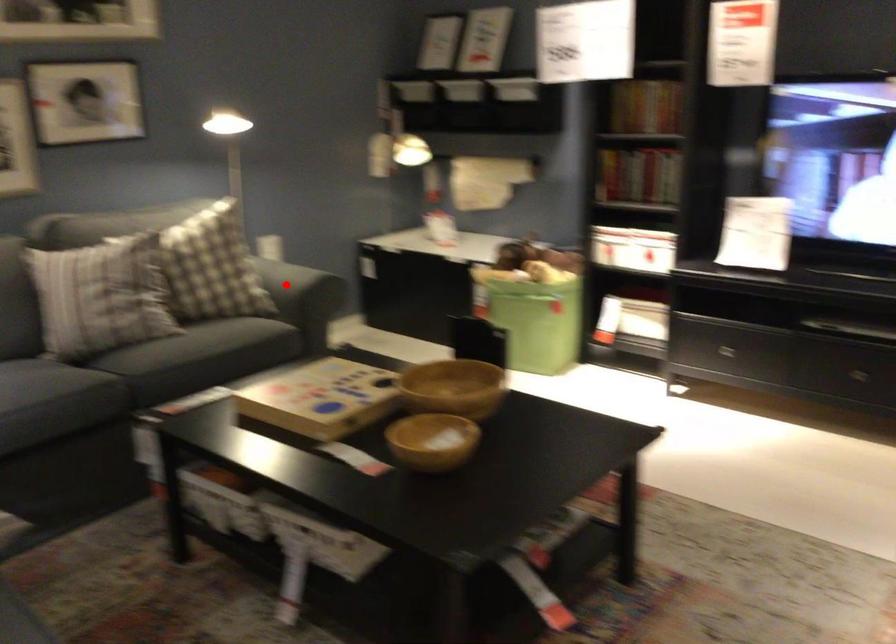
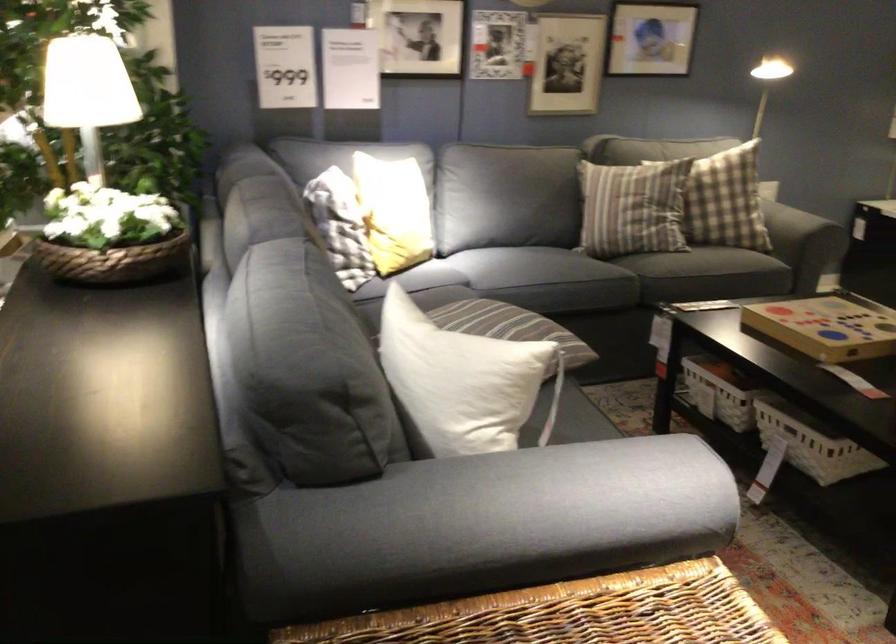
Question: I am providing you with two images of the same scene from different viewpoints. A red point is marked on the first image. At the location where the point appears in image 1, is it still visible in image 2?

Choices:
 (A) Yes
 (B) No

Answer: (B)